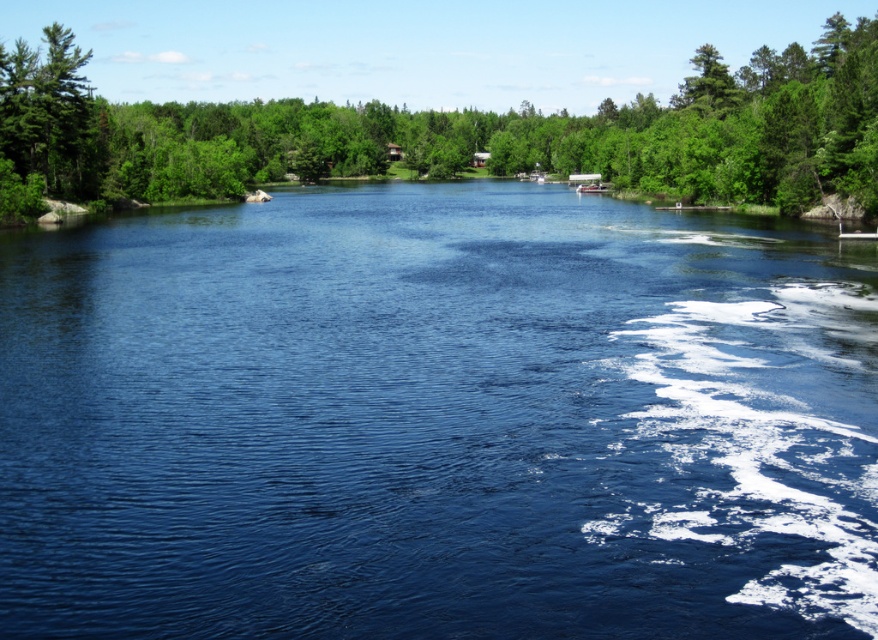
You are standing on the riverbank and want to determine which object in the scene is closer to you. You see the blue water at center and the green leafy tree at upper center. Based on their heights, which one is closer?

The blue water at center is shorter than the green leafy tree at upper center, so the blue water at center is closer to you.

In the scene shown: You are standing at the center of the river and want to reach the green leafy tree at upper center. Which direction should you head towards?

The green leafy tree at upper center is located at point 0.206 on the x axis and 0.527 on the y axis. Since you are at the center of the river, you should head towards the upper center direction to reach it.

You are a photographer planning to capture the entire scene in one shot. Given that the blue water at center and the green matte tree at upper left are both crucial elements, which object will occupy a bigger portion of your photo?

The blue water at center will occupy a bigger portion of your photo because it is larger in size than the green matte tree at upper left.